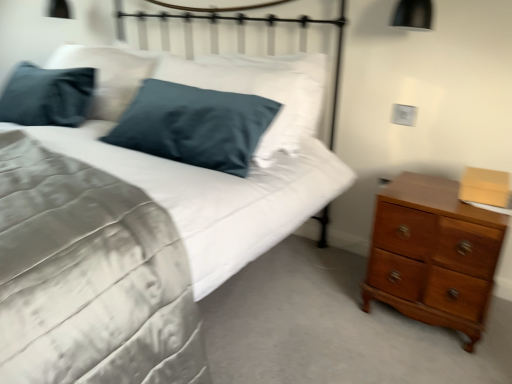
Question: Can you confirm if metallic white headboard at upper center is positioned to the left of shiny brown wooden chest of drawers at right?

Choices:
 (A) yes
 (B) no

Answer: (A)

Question: From the image's perspective, is metallic white headboard at upper center on top of shiny brown wooden chest of drawers at right?

Choices:
 (A) no
 (B) yes

Answer: (B)

Question: Considering the relative sizes of metallic white headboard at upper center and shiny brown wooden chest of drawers at right in the image provided, is metallic white headboard at upper center bigger than shiny brown wooden chest of drawers at right?

Choices:
 (A) no
 (B) yes

Answer: (B)

Question: From a real-world perspective, is metallic white headboard at upper center positioned under shiny brown wooden chest of drawers at right based on gravity?

Choices:
 (A) no
 (B) yes

Answer: (A)

Question: Can you confirm if metallic white headboard at upper center is wider than shiny brown wooden chest of drawers at right?

Choices:
 (A) yes
 (B) no

Answer: (B)

Question: In terms of width, does satin blue pillow at upper left look wider or thinner when compared to metallic white headboard at upper center?

Choices:
 (A) thin
 (B) wide

Answer: (B)

Question: Considering the positions of point (167, 251) and point (173, 49), is point (167, 251) closer or farther from the camera than point (173, 49)?

Choices:
 (A) closer
 (B) farther

Answer: (A)

Question: Considering their positions, is satin blue pillow at upper left located in front of or behind metallic white headboard at upper center?

Choices:
 (A) front
 (B) behind

Answer: (A)

Question: Based on their positions, is satin blue pillow at upper left located to the left or right of metallic white headboard at upper center?

Choices:
 (A) left
 (B) right

Answer: (A)

Question: Considering the positions of metallic white headboard at upper center and shiny brown wooden chest of drawers at right in the image, is metallic white headboard at upper center taller or shorter than shiny brown wooden chest of drawers at right?

Choices:
 (A) short
 (B) tall

Answer: (B)

Question: Considering the positions of metallic white headboard at upper center and shiny brown wooden chest of drawers at right in the image, is metallic white headboard at upper center wider or thinner than shiny brown wooden chest of drawers at right?

Choices:
 (A) thin
 (B) wide

Answer: (A)

Question: Based on their sizes in the image, would you say metallic white headboard at upper center is bigger or smaller than shiny brown wooden chest of drawers at right?

Choices:
 (A) big
 (B) small

Answer: (A)

Question: Relative to shiny brown wooden chest of drawers at right, is metallic white headboard at upper center in front or behind?

Choices:
 (A) front
 (B) behind

Answer: (B)

Question: Which is correct: satin blue pillow at upper left is inside black matte lampshade at upper right, or outside of it?

Choices:
 (A) outside
 (B) inside

Answer: (A)

Question: From their relative heights in the image, would you say satin blue pillow at upper left is taller or shorter than black matte lampshade at upper right?

Choices:
 (A) tall
 (B) short

Answer: (A)